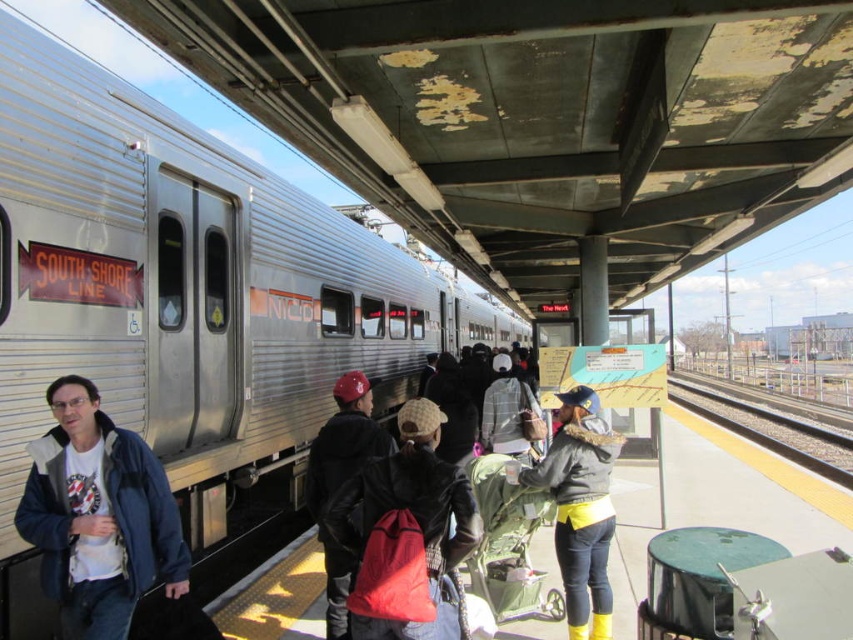
You are a passenger on the platform and want to board the SOUTH SHORE LINE train. There are two people wearing jackets at the center of the platform. Which jacket is closer to the train doors? The options are the matte blue jacket at center and the black leather jacket at center.

The matte blue jacket at center is in front of the black leather jacket at center, so the matte blue jacket at center is closer to the train doors.